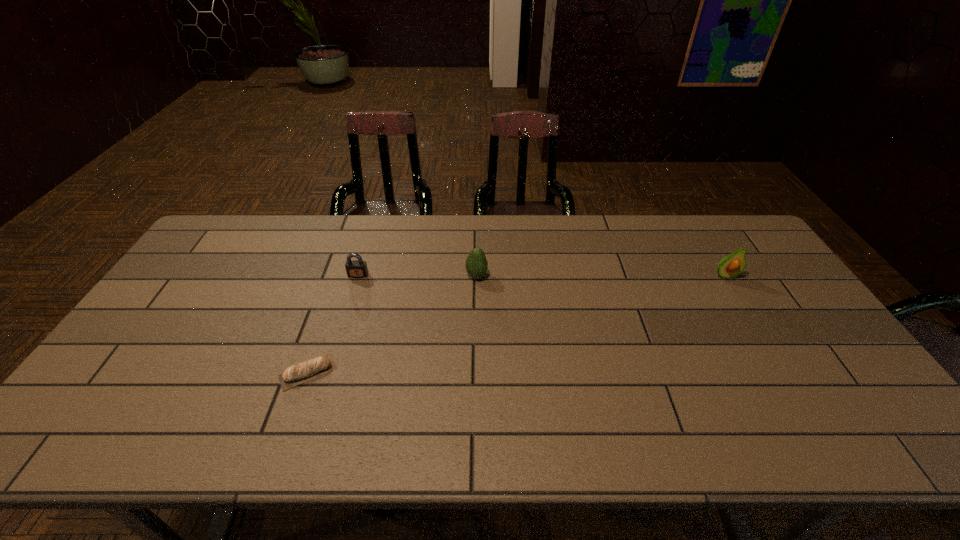
Locate an element on the screen. the right avocado is located at coordinates (731, 266).

This screenshot has height=540, width=960. What are the coordinates of `the third object from left to right` in the screenshot? It's located at (476, 263).

The width and height of the screenshot is (960, 540). I want to click on the second shortest object, so click(x=358, y=268).

This screenshot has height=540, width=960. I want to click on pita bread, so click(x=294, y=375).

Locate an element on the screen. the nearest object is located at coordinates (294, 375).

The image size is (960, 540). I want to click on free spot located on the cut side of the right avocado, so click(739, 299).

What are the coordinates of `blank space located 0.260m on the back of the left avocado` in the screenshot? It's located at tap(477, 222).

Find the location of a particular element. vacant area located on the front of the third tallest object near the keyhole is located at coordinates (334, 353).

Where is `free space located on the back of the shortest object`? This screenshot has width=960, height=540. free space located on the back of the shortest object is located at coordinates click(330, 307).

Identify the location of object at the right edge. Image resolution: width=960 pixels, height=540 pixels. click(731, 266).